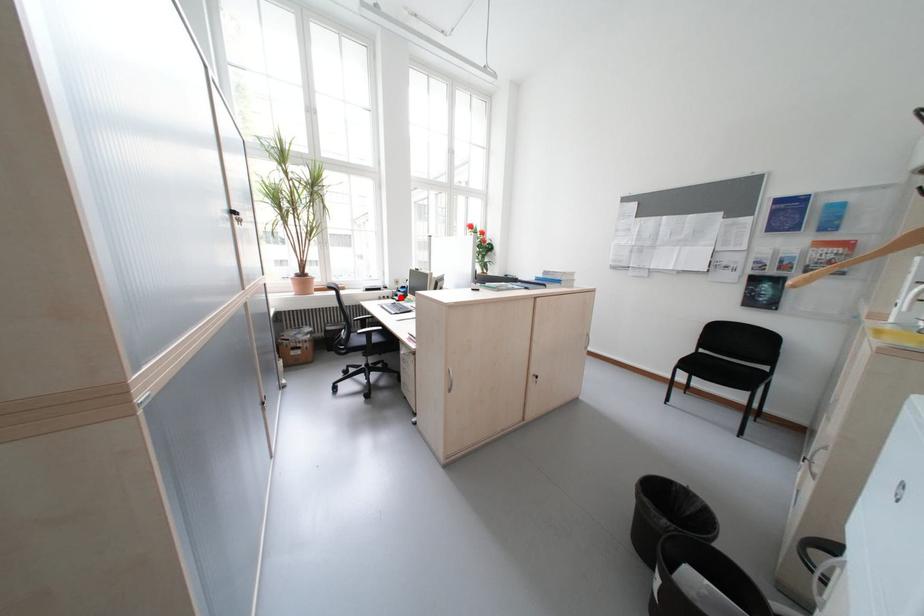
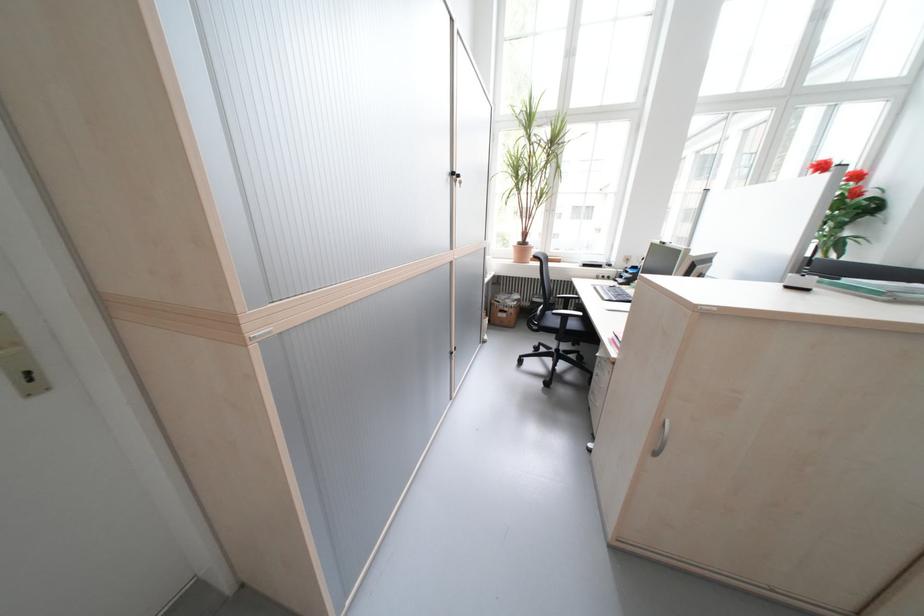
Question: I am providing you with two images of the same scene from different viewpoints. A red point is marked on the first image. Can you still see the location of the red point in image 2?

Choices:
 (A) Yes
 (B) No

Answer: (A)